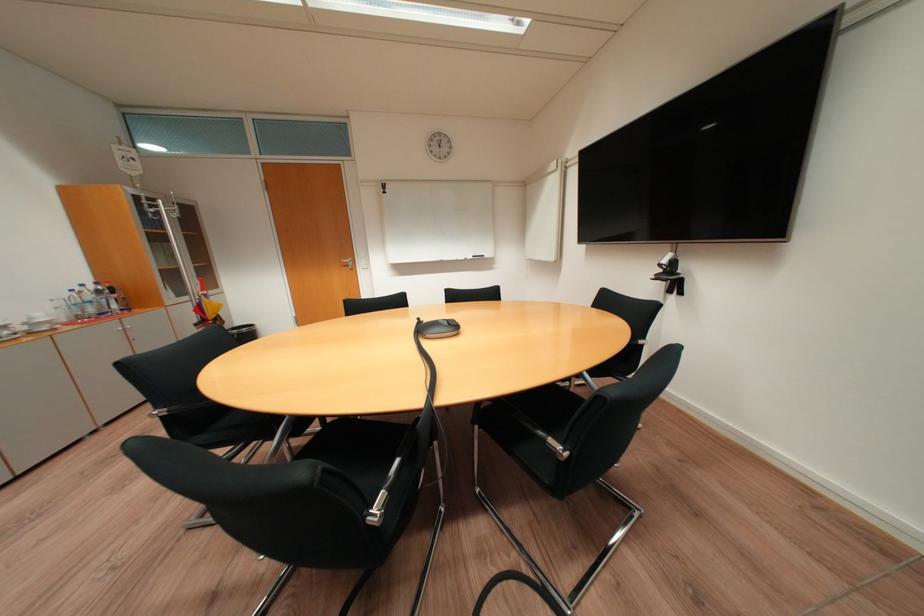
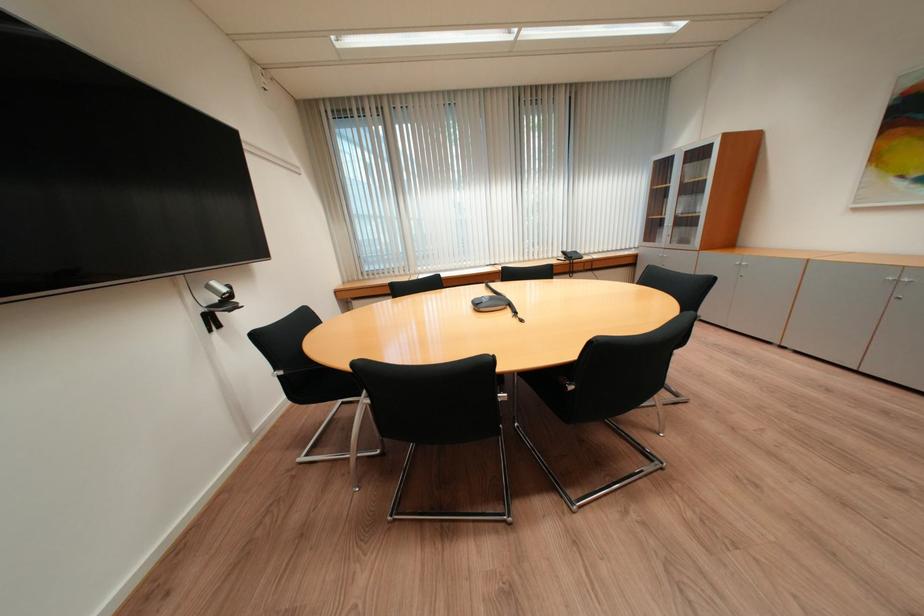
Question: I am providing you with two images of the same scene from different viewpoints. After the viewpoint changes to image2, which objects are now occluded?

Choices:
 (A) black chair sitting surface
 (B) black telephone handset
 (C) silver cabinet handle
 (D) red checkered curtain

Answer: (A)